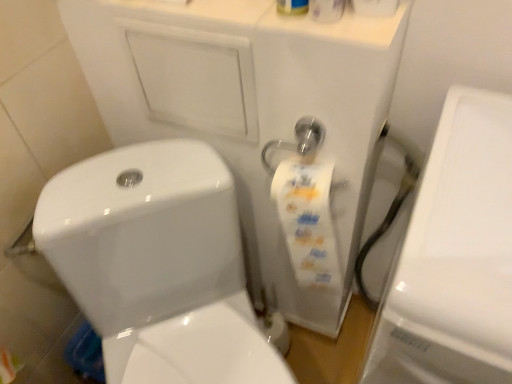
Question: From the image's perspective, is white glossy toilet at center under white glossy porcelain at right?

Choices:
 (A) yes
 (B) no

Answer: (A)

Question: Is white glossy toilet at center not inside white glossy porcelain at right?

Choices:
 (A) no
 (B) yes

Answer: (B)

Question: Could you tell me if white glossy toilet at center is turned towards white glossy porcelain at right?

Choices:
 (A) yes
 (B) no

Answer: (B)

Question: From the image's perspective, would you say white glossy toilet at center is positioned over white glossy porcelain at right?

Choices:
 (A) yes
 (B) no

Answer: (B)

Question: Considering the relative positions of white glossy toilet at center and white glossy porcelain at right in the image provided, is white glossy toilet at center behind white glossy porcelain at right?

Choices:
 (A) no
 (B) yes

Answer: (B)

Question: Considering the relative sizes of white glossy toilet at center and white glossy porcelain at right in the image provided, is white glossy toilet at center bigger than white glossy porcelain at right?

Choices:
 (A) no
 (B) yes

Answer: (A)

Question: From the image's perspective, is white glossy porcelain at right on top of white glossy toilet at center?

Choices:
 (A) yes
 (B) no

Answer: (A)

Question: Is white glossy porcelain at right next to white glossy toilet at center?

Choices:
 (A) yes
 (B) no

Answer: (B)

Question: Considering the relative sizes of white glossy porcelain at right and white glossy toilet at center in the image provided, is white glossy porcelain at right smaller than white glossy toilet at center?

Choices:
 (A) no
 (B) yes

Answer: (A)

Question: Is white glossy porcelain at right closer to camera compared to white glossy toilet at center?

Choices:
 (A) yes
 (B) no

Answer: (A)

Question: Is white glossy porcelain at right not inside white glossy toilet at center?

Choices:
 (A) no
 (B) yes

Answer: (B)

Question: Is white glossy porcelain at right positioned with its back to white glossy toilet at center?

Choices:
 (A) no
 (B) yes

Answer: (A)

Question: Is white glossy toilet paper at upper center beside white glossy toilet at center?

Choices:
 (A) yes
 (B) no

Answer: (B)